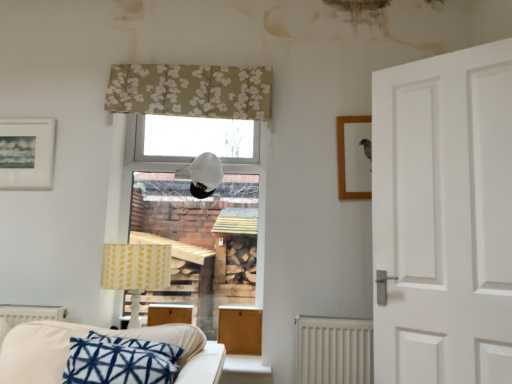
Question: Considering the relative sizes of white matte table lamp at center, the second table lamp in the bottom-to-top sequence, and yellow fabric lampshade at lower left, marked as the 1th table lamp in a left-to-right arrangement, in the image provided, is white matte table lamp at center, the second table lamp in the bottom-to-top sequence, smaller than yellow fabric lampshade at lower left, marked as the 1th table lamp in a left-to-right arrangement,?

Choices:
 (A) yes
 (B) no

Answer: (A)

Question: Is white matte table lamp at center, marked as the first table lamp in a right-to-left arrangement, positioned beyond the bounds of yellow fabric lampshade at lower left, the first table lamp when ordered from bottom to top?

Choices:
 (A) yes
 (B) no

Answer: (A)

Question: From the image's perspective, would you say white matte table lamp at center, the second table lamp in the bottom-to-top sequence, is shown under yellow fabric lampshade at lower left, which appears as the second table lamp when viewed from the top?

Choices:
 (A) no
 (B) yes

Answer: (A)

Question: Does white matte table lamp at center, marked as the 2th table lamp in a left-to-right arrangement, come behind yellow fabric lampshade at lower left, the first table lamp when ordered from bottom to top?

Choices:
 (A) yes
 (B) no

Answer: (A)

Question: Is yellow fabric lampshade at lower left, the 2th table lamp viewed from the right, completely or partially inside white matte table lamp at center, marked as the 2th table lamp in a left-to-right arrangement?

Choices:
 (A) yes
 (B) no

Answer: (B)

Question: Is white matte table lamp at center, marked as the 1th table lamp in a top-to-bottom arrangement, directly adjacent to yellow fabric lampshade at lower left, which appears as the second table lamp when viewed from the top?

Choices:
 (A) yes
 (B) no

Answer: (B)

Question: Does beige floral fabric at upper center have a greater width compared to wooden picture frame at upper right, which is the 1th picture frame from right to left?

Choices:
 (A) no
 (B) yes

Answer: (B)

Question: Is beige floral fabric at upper center thinner than wooden picture frame at upper right, arranged as the 2th picture frame when viewed from the left?

Choices:
 (A) yes
 (B) no

Answer: (B)

Question: From a real-world perspective, does beige floral fabric at upper center stand above wooden picture frame at upper right, which is the 1th picture frame from right to left?

Choices:
 (A) no
 (B) yes

Answer: (B)

Question: Considering the relative positions of beige floral fabric at upper center and wooden picture frame at upper right, arranged as the 2th picture frame when viewed from the left, in the image provided, is beige floral fabric at upper center in front of wooden picture frame at upper right, arranged as the 2th picture frame when viewed from the left,?

Choices:
 (A) yes
 (B) no

Answer: (B)

Question: Considering the relative sizes of beige floral fabric at upper center and wooden picture frame at upper right, arranged as the 2th picture frame when viewed from the left, in the image provided, is beige floral fabric at upper center shorter than wooden picture frame at upper right, arranged as the 2th picture frame when viewed from the left,?

Choices:
 (A) yes
 (B) no

Answer: (A)

Question: Does beige floral fabric at upper center have a larger size compared to wooden picture frame at upper right, which is the 1th picture frame from right to left?

Choices:
 (A) yes
 (B) no

Answer: (A)

Question: Is white fabric couch at lower left surrounding white matte table lamp at center, marked as the 1th table lamp in a top-to-bottom arrangement?

Choices:
 (A) no
 (B) yes

Answer: (A)